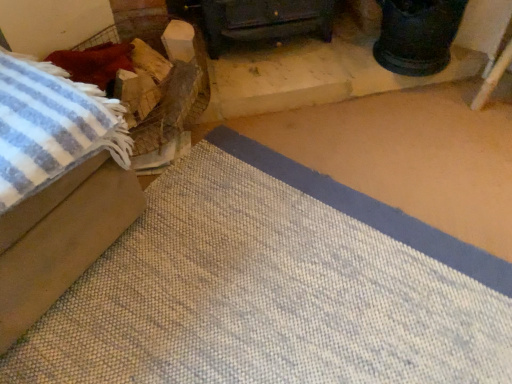
Question: Is beige fabric ottoman at left, the first furniture positioned from the front, directly adjacent to dark wood stove at center, which appears as the 1th furniture when viewed from the right?

Choices:
 (A) no
 (B) yes

Answer: (A)

Question: Is beige fabric ottoman at left, which is the 1th furniture from left to right, shorter than dark wood stove at center, which appears as the second furniture when viewed from the left?

Choices:
 (A) no
 (B) yes

Answer: (A)

Question: Is beige fabric ottoman at left, marked as the 2th furniture in a back-to-front arrangement, bigger than dark wood stove at center, the 1th furniture viewed from the back?

Choices:
 (A) no
 (B) yes

Answer: (B)

Question: Is beige fabric ottoman at left, which is the second furniture in right-to-left order, to the right of dark wood stove at center, the 2th furniture when ordered from front to back, from the viewer's perspective?

Choices:
 (A) yes
 (B) no

Answer: (B)

Question: Is beige fabric ottoman at left, which is the second furniture in right-to-left order, further to camera compared to dark wood stove at center, which appears as the second furniture when viewed from the left?

Choices:
 (A) no
 (B) yes

Answer: (A)

Question: Could you tell me if beige fabric ottoman at left, the first furniture positioned from the front, is turned towards dark wood stove at center, the 1th furniture viewed from the back?

Choices:
 (A) yes
 (B) no

Answer: (B)

Question: Can you confirm if dark wood stove at center, which appears as the 1th furniture when viewed from the right, is positioned to the left of beige fabric ottoman at left, which is the second furniture in right-to-left order?

Choices:
 (A) no
 (B) yes

Answer: (A)

Question: Can you confirm if dark wood stove at center, the 1th furniture viewed from the back, is positioned to the right of beige fabric ottoman at left, which is the 1th furniture from left to right?

Choices:
 (A) yes
 (B) no

Answer: (A)

Question: Is dark wood stove at center, which appears as the second furniture when viewed from the left, bigger than beige fabric ottoman at left, which is the second furniture in right-to-left order?

Choices:
 (A) yes
 (B) no

Answer: (B)

Question: Is dark wood stove at center, which appears as the second furniture when viewed from the left, further to the viewer compared to beige fabric ottoman at left, marked as the 2th furniture in a back-to-front arrangement?

Choices:
 (A) no
 (B) yes

Answer: (B)

Question: Is dark wood stove at center, which appears as the 1th furniture when viewed from the right, turned away from beige fabric ottoman at left, marked as the 2th furniture in a back-to-front arrangement?

Choices:
 (A) yes
 (B) no

Answer: (B)

Question: Is dark wood stove at center, the 2th furniture when ordered from front to back, outside beige fabric ottoman at left, the first furniture positioned from the front?

Choices:
 (A) yes
 (B) no

Answer: (A)

Question: Considering the positions of beige fabric ottoman at left, marked as the 2th furniture in a back-to-front arrangement, and dark wood stove at center, the 1th furniture viewed from the back, in the image, is beige fabric ottoman at left, marked as the 2th furniture in a back-to-front arrangement, taller or shorter than dark wood stove at center, the 1th furniture viewed from the back,?

Choices:
 (A) tall
 (B) short

Answer: (A)